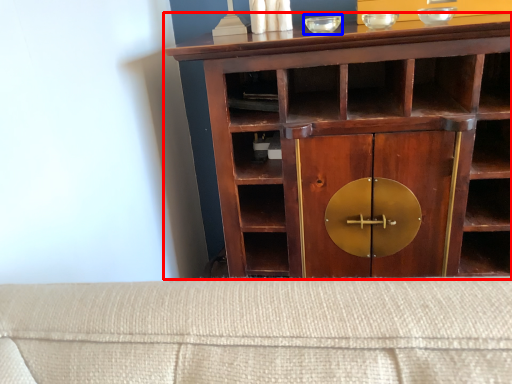
Question: Which of the following is the closest to the observer, cupboard (highlighted by a red box) or glass bowl (highlighted by a blue box)?

Choices:
 (A) cupboard
 (B) glass bowl

Answer: (A)